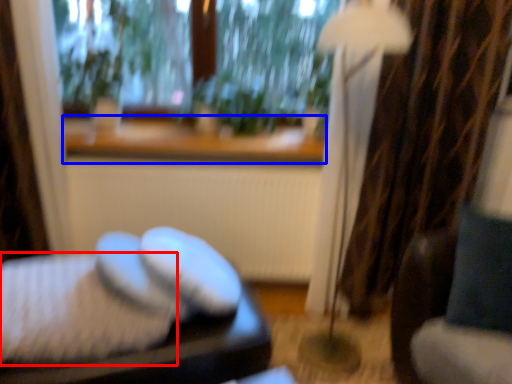
Question: Among these objects, which one is farthest to the camera, sheet (highlighted by a red box) or window sill (highlighted by a blue box)?

Choices:
 (A) sheet
 (B) window sill

Answer: (B)